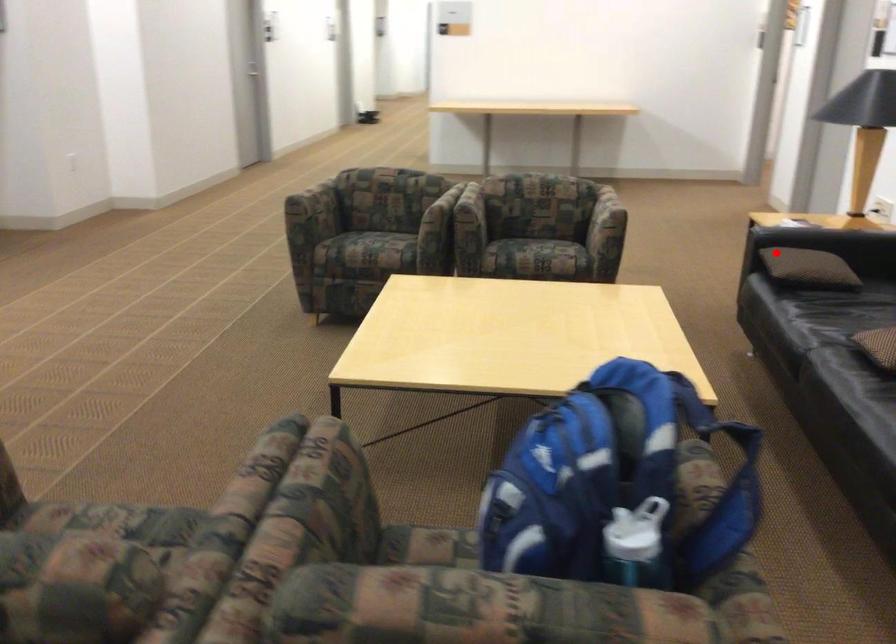
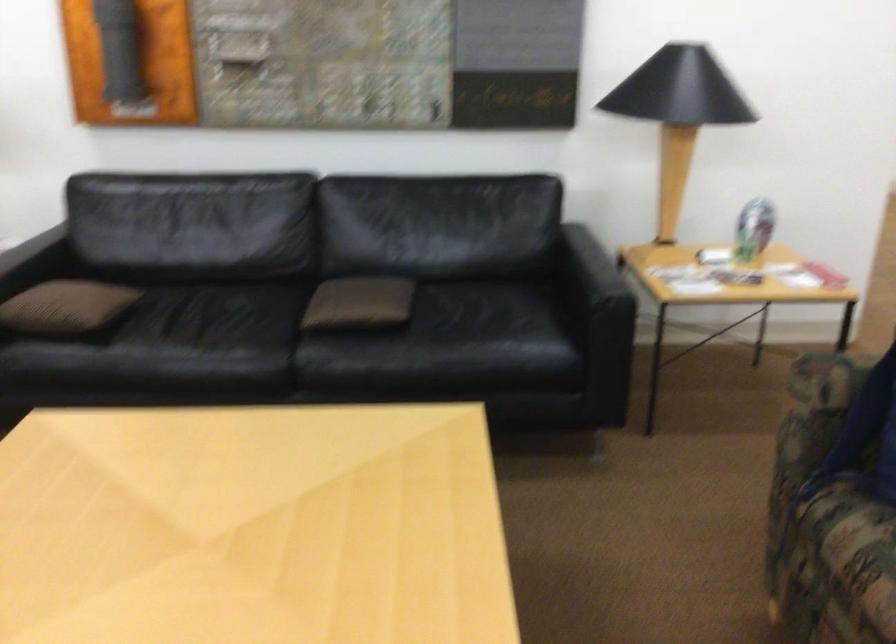
Question: I am providing you with two images of the same scene from different viewpoints. Given a red point in image1, look at the same physical point in image2. Is it:

Choices:
 (A) Closer to the viewpoint
 (B) Farther from the viewpoint

Answer: (A)